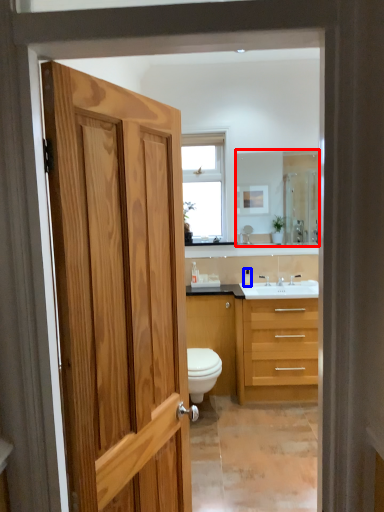
Question: Which object appears farthest to the camera in this image, mirror (highlighted by a red box) or toiletry (highlighted by a blue box)?

Choices:
 (A) mirror
 (B) toiletry

Answer: (B)